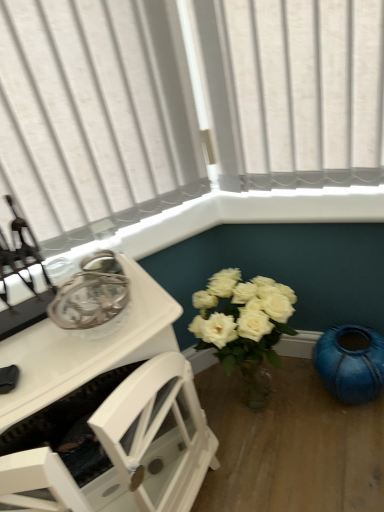
I want to click on free space above teal glossy vase at lower right (from a real-world perspective), so click(348, 343).